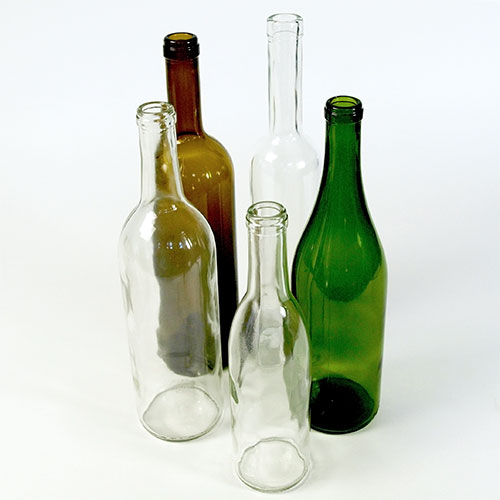
This screenshot has width=500, height=500. What are the coordinates of `glass bottles` in the screenshot? It's located at click(162, 215), click(193, 156), click(283, 80), click(253, 294), click(339, 259).